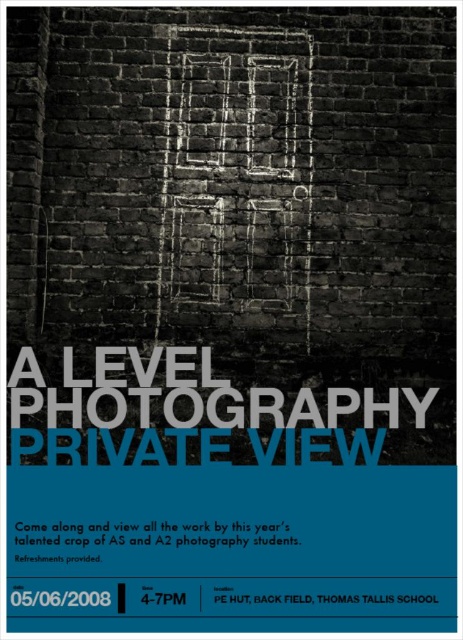
Question: Observing the image, what is the correct spatial positioning of white paper at center in reference to black paper at lower center?

Choices:
 (A) below
 (B) above

Answer: (B)

Question: Is white paper at center wider than black paper at lower center?

Choices:
 (A) no
 (B) yes

Answer: (B)

Question: Which point is closer to the camera?

Choices:
 (A) white paper at center
 (B) black paper at lower center

Answer: (B)

Question: Which of the following is the closest to the observer?

Choices:
 (A) white paper at center
 (B) black paper at lower center

Answer: (B)

Question: Considering the relative positions of white paper at center and black paper at lower center in the image provided, where is white paper at center located with respect to black paper at lower center?

Choices:
 (A) above
 (B) below

Answer: (A)